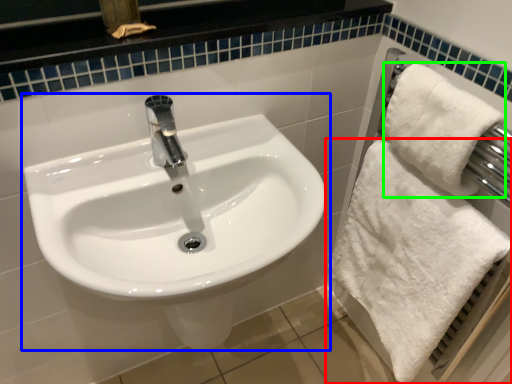
Question: Considering the real-world distances, which object is farthest from towel (highlighted by a red box)? sink (highlighted by a blue box) or bath towel (highlighted by a green box)?

Choices:
 (A) sink
 (B) bath towel

Answer: (A)